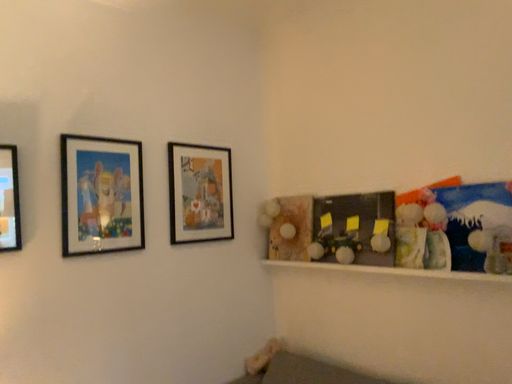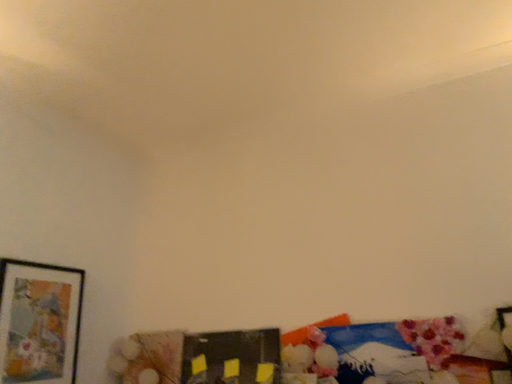
Question: Which way did the camera rotate in the video?

Choices:
 (A) rotated left
 (B) rotated right

Answer: (B)